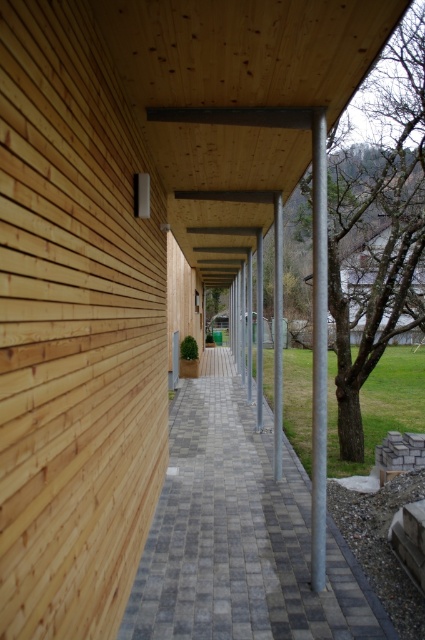
You are a delivery person with a cart that is 6 feet wide. You need to navigate through the walkway between the gray checkered paving at center and the galvanized metal pole at center. Can your cart fit through the space between them?

The gray checkered paving at center and the galvanized metal pole at center are 6.84 feet apart from each other. Since your cart is 6 feet wide, it can fit through the space between them as the distance is slightly larger than the cart width.

You are standing at the entrance of the building and want to walk to the gray checkered paving at center. Based on the coordinates provided, in which direction should you move from your current position?

The gray checkered paving at center is located at coordinates point (238, 534), so you should move towards the center of the walkway to reach it.

You are a maintenance worker tasked with checking the height of the gray checkered paving at center and the galvanized metal pole at center. Which one has a greater height?

The gray checkered paving at center is not as tall as the galvanized metal pole at center, so the galvanized metal pole at center is taller.